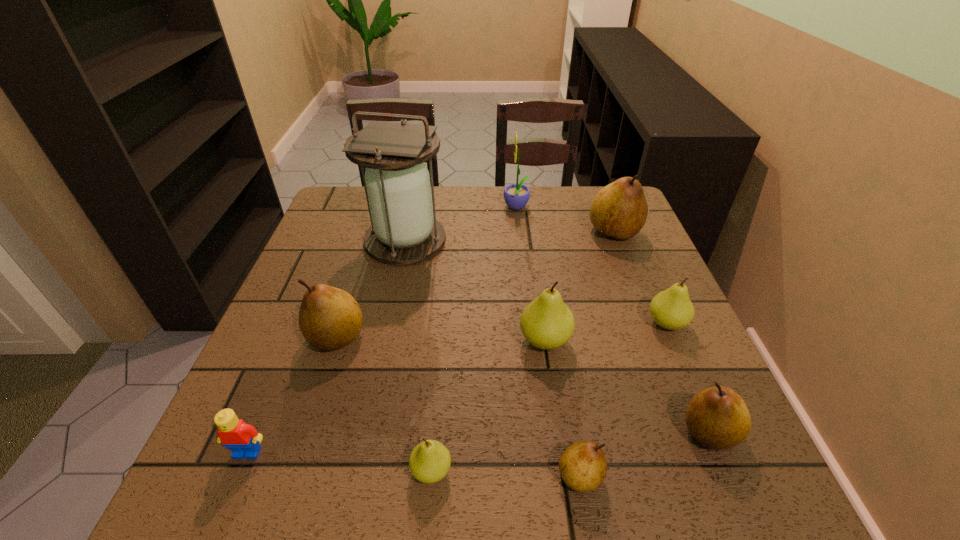
Locate an element on the screen. The image size is (960, 540). free region at the near left corner of the desktop is located at coordinates (259, 476).

Locate an element on the screen. empty space between the farthest brown pear and the second smallest brown pear is located at coordinates (661, 332).

This screenshot has width=960, height=540. What are the coordinates of `unoccupied position between the Lego and the second smallest green pear` in the screenshot? It's located at (457, 388).

The width and height of the screenshot is (960, 540). What are the coordinates of `free spot between the farthest pear and the leftmost brown pear` in the screenshot? It's located at (475, 285).

Identify the location of vacant space that's between the third biggest brown pear and the third nearest brown pear. This screenshot has width=960, height=540. (523, 384).

Image resolution: width=960 pixels, height=540 pixels. In order to click on free space between the farthest brown pear and the smallest green pear in this screenshot , I will do `click(522, 351)`.

In order to click on empty space that is in between the sunflower and the rightmost green pear in this screenshot , I will do `click(591, 266)`.

Where is `vacant point located between the leftmost brown pear and the third biggest brown pear`? This screenshot has height=540, width=960. vacant point located between the leftmost brown pear and the third biggest brown pear is located at coordinates (523, 384).

The height and width of the screenshot is (540, 960). I want to click on unoccupied area between the leftmost green pear and the biggest brown pear, so [x=522, y=351].

Where is `object identified as the ninth closest to the red Lego`? This screenshot has height=540, width=960. object identified as the ninth closest to the red Lego is located at coordinates (619, 210).